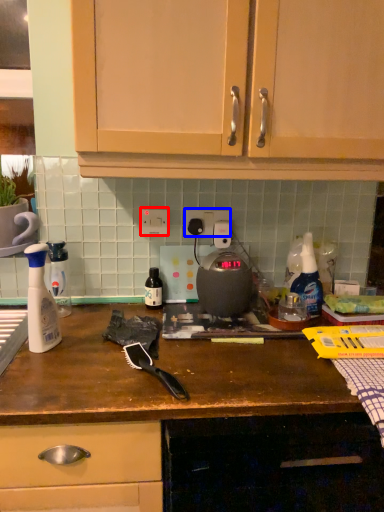
Question: Among these objects, which one is farthest to the camera, electric outlet (highlighted by a red box) or electric outlet (highlighted by a blue box)?

Choices:
 (A) electric outlet
 (B) electric outlet

Answer: (B)